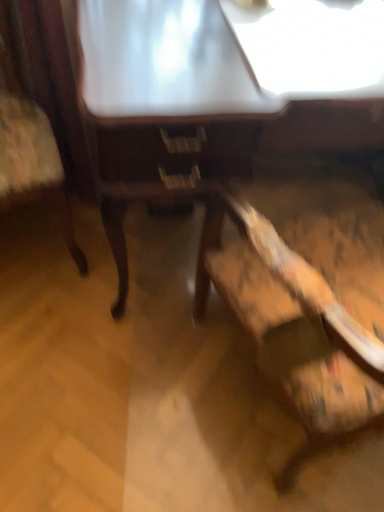
Question: Is wooden chair at left, placed as the second chair when sorted from right to left, wider or thinner than wooden chair at lower right, which is the 1th chair from right to left?

Choices:
 (A) wide
 (B) thin

Answer: (B)

Question: From the image's perspective, is wooden chair at left, placed as the second chair when sorted from right to left, located above or below wooden chair at lower right, the 2th chair from the left?

Choices:
 (A) below
 (B) above

Answer: (B)

Question: Based on their relative distances, which object is farther from the wooden chair at lower right, the 2th chair from the left?

Choices:
 (A) wooden table at center
 (B) wooden chair at left, placed as the second chair when sorted from right to left

Answer: (B)

Question: Which object is positioned closest to the wooden chair at lower right, which is the 1th chair from right to left?

Choices:
 (A) wooden chair at left, placed as the second chair when sorted from right to left
 (B) wooden table at center

Answer: (B)